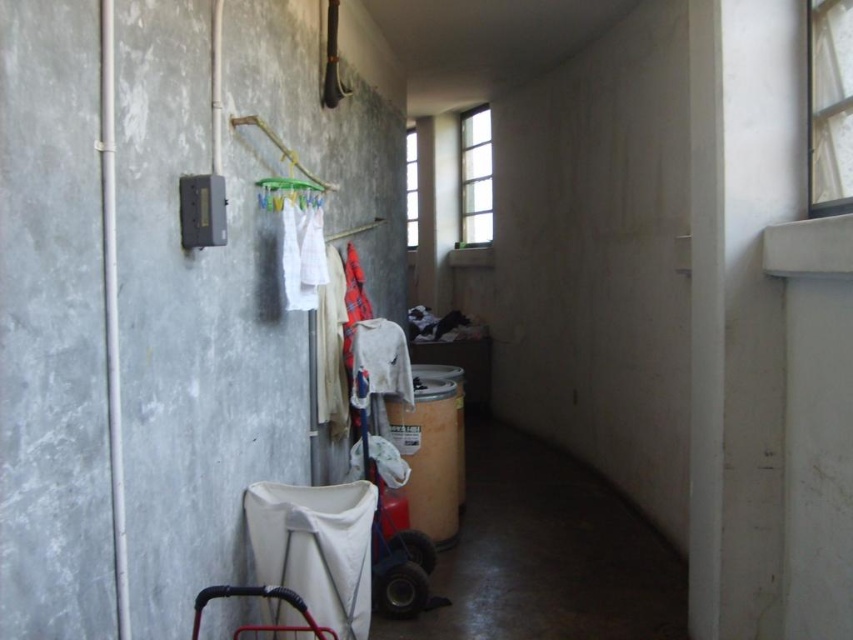
Question: Among these points, which one is nearest to the camera?

Choices:
 (A) (815, 120)
 (B) (474, 227)

Answer: (A)

Question: Which point is farther to the camera?

Choices:
 (A) clear glass window at upper center
 (B) white sheer curtain at upper right

Answer: (A)

Question: Is white sheer curtain at upper right bigger than transparent glass window at upper center?

Choices:
 (A) no
 (B) yes

Answer: (A)

Question: Which point is closer to the camera?

Choices:
 (A) plastic/yellow hanger at center
 (B) clear glass window at upper center
 (C) white sheer curtain at upper right

Answer: (C)

Question: Is white fabric at center further to camera compared to metallic baby carriage at lower left?

Choices:
 (A) yes
 (B) no

Answer: (A)

Question: Is plastic/yellow hanger at center below transparent glass window at upper center?

Choices:
 (A) no
 (B) yes

Answer: (B)